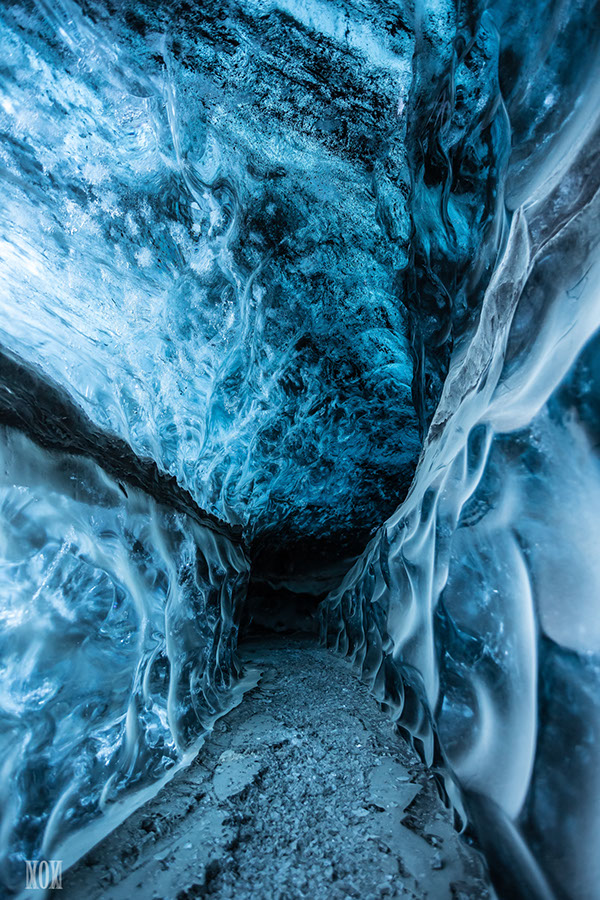
This screenshot has width=600, height=900. I want to click on ceiling, so (306, 346).